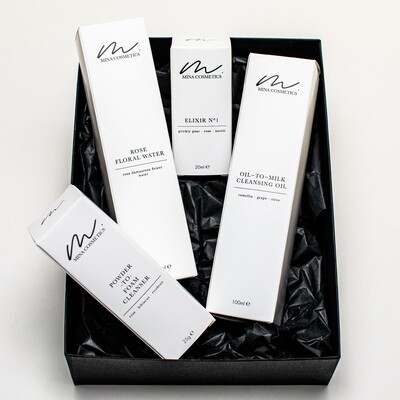
Where is `box`? The height and width of the screenshot is (400, 400). box is located at coordinates (194, 320).